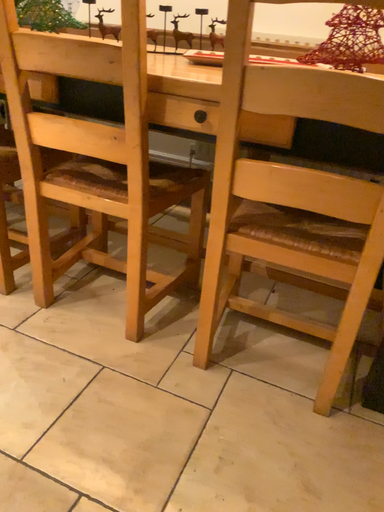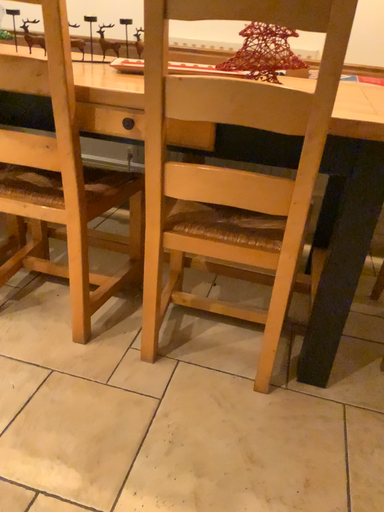
Question: Which way did the camera rotate in the video?

Choices:
 (A) rotated left
 (B) rotated right

Answer: (B)